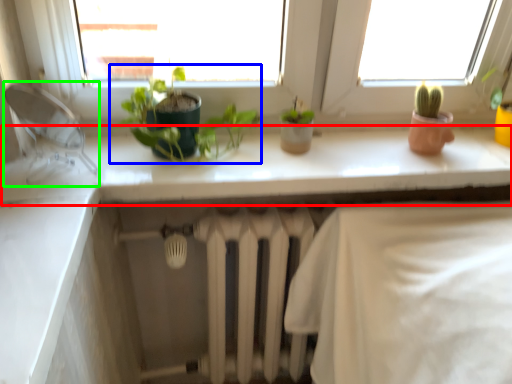
Question: Which is nearer to the counter top (highlighted by a red box)? houseplant (highlighted by a blue box) or faucet (highlighted by a green box).

Choices:
 (A) houseplant
 (B) faucet

Answer: (A)